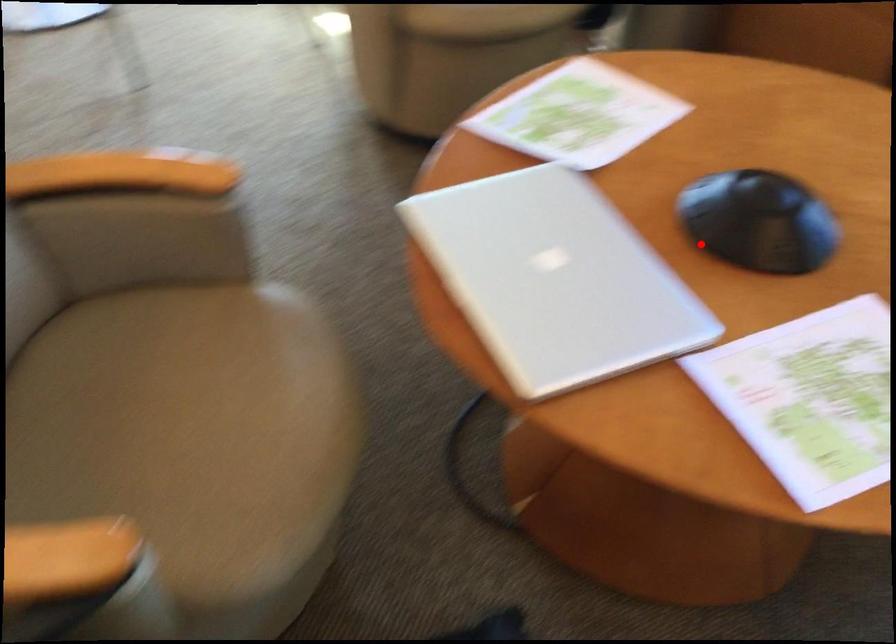
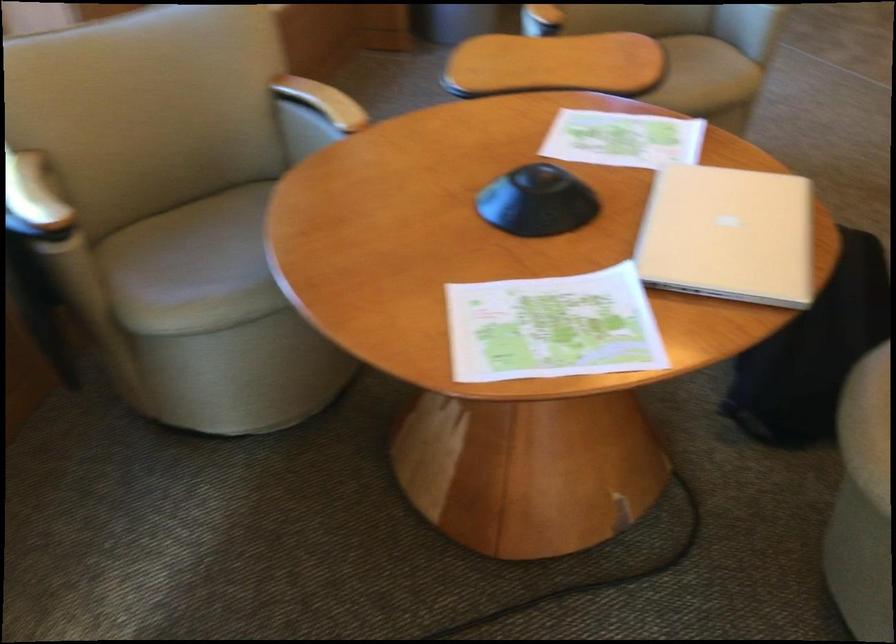
The point at the highlighted location is marked in the first image. Where is the corresponding point in the second image?

(537, 202)